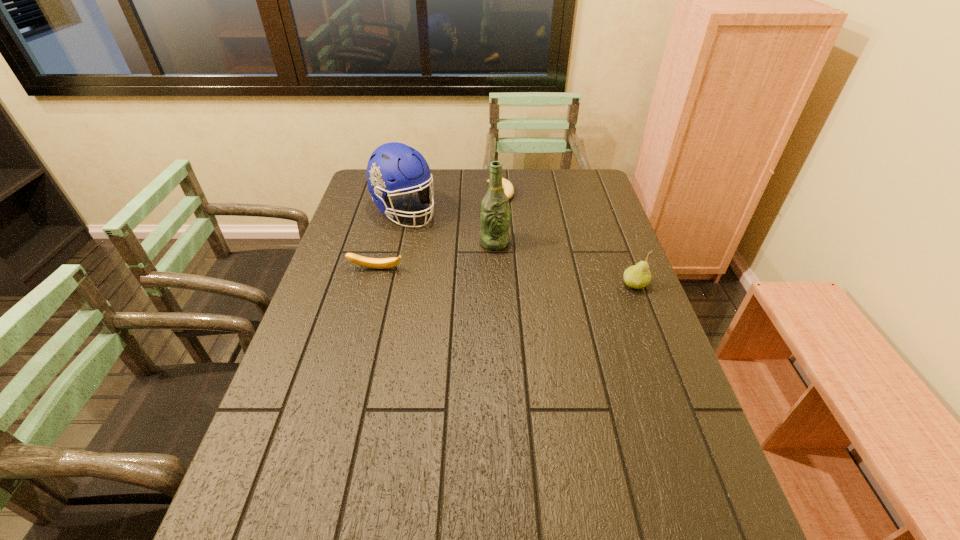
Where is `vacant area that satisfies the following two spatial constraints: 1. on the front side of the nearest object; 2. on the left side of the second tallest object`? vacant area that satisfies the following two spatial constraints: 1. on the front side of the nearest object; 2. on the left side of the second tallest object is located at coordinates pos(388,285).